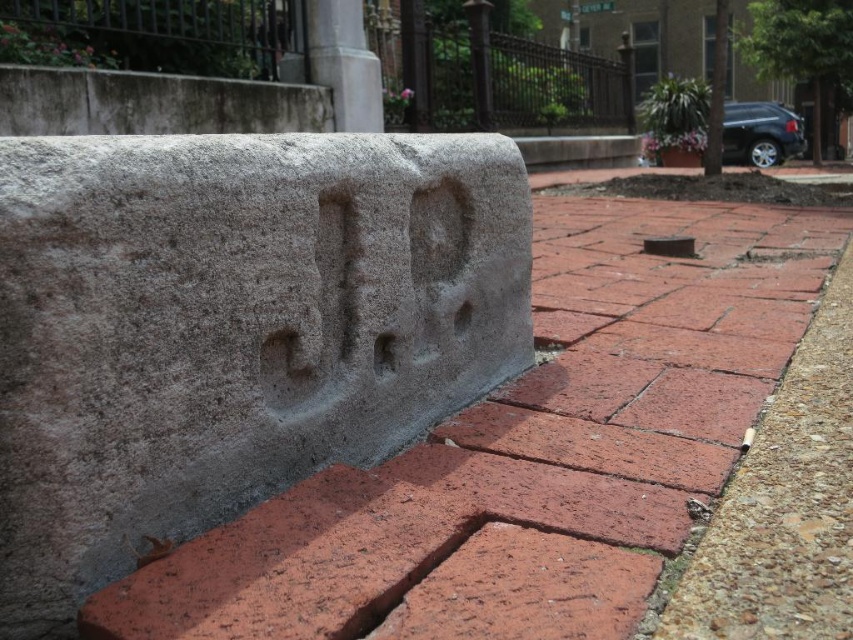
Question: Which object is farther from the camera taking this photo?

Choices:
 (A) gray concrete at center
 (B) red brick pavement at lower right

Answer: (B)

Question: Does gray concrete at center have a smaller size compared to red brick pavement at lower right?

Choices:
 (A) no
 (B) yes

Answer: (B)

Question: Does gray concrete at center have a larger size compared to red brick pavement at lower right?

Choices:
 (A) no
 (B) yes

Answer: (A)

Question: From the image, what is the correct spatial relationship of gray concrete at center in relation to red brick pavement at lower right?

Choices:
 (A) above
 (B) below

Answer: (A)

Question: Which point is farther to the camera?

Choices:
 (A) (148, 346)
 (B) (653, 632)

Answer: (A)